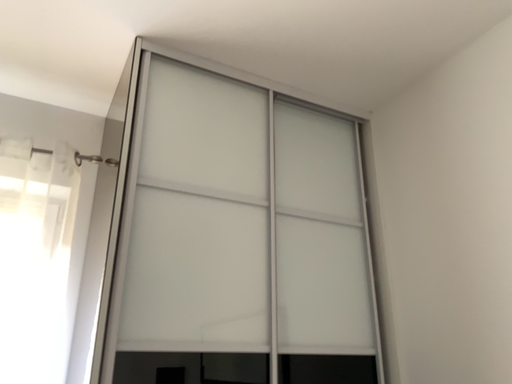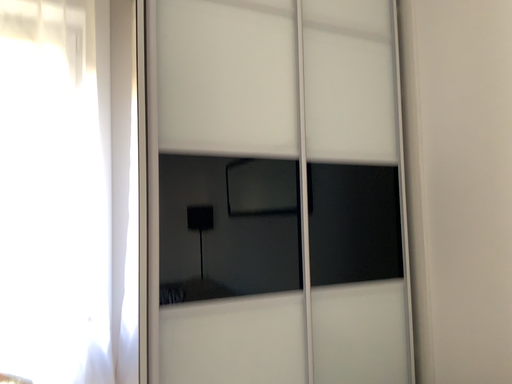
Question: Which way did the camera rotate in the video?

Choices:
 (A) rotated upward
 (B) rotated downward

Answer: (B)